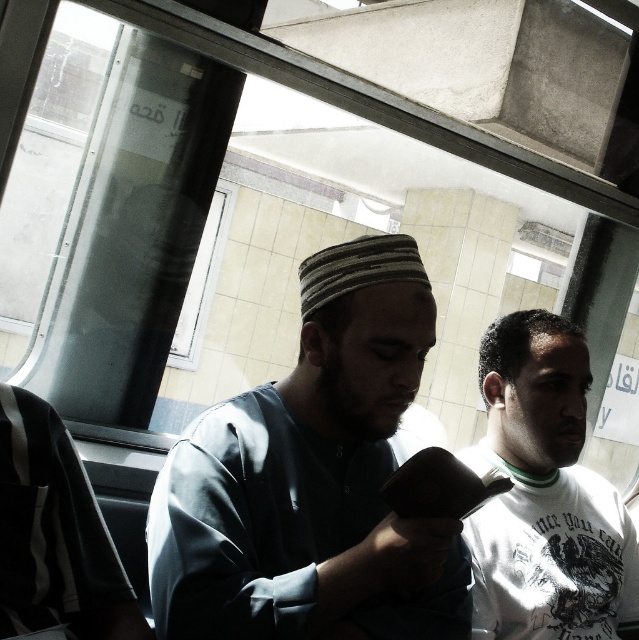
You are holding a camera and want to take a photo of the light blue fabric shirt at center. The camera requires a minimum distance of 1 meter to focus properly. Can you take a clear photo from your current position?

The light blue fabric shirt at center and camera are 94.42 centimeters apart. Since 94.42 centimeters is less than 1 meter, the camera cannot focus properly. You need to move back to ensure the distance is at least 1 meter for a clear photo.